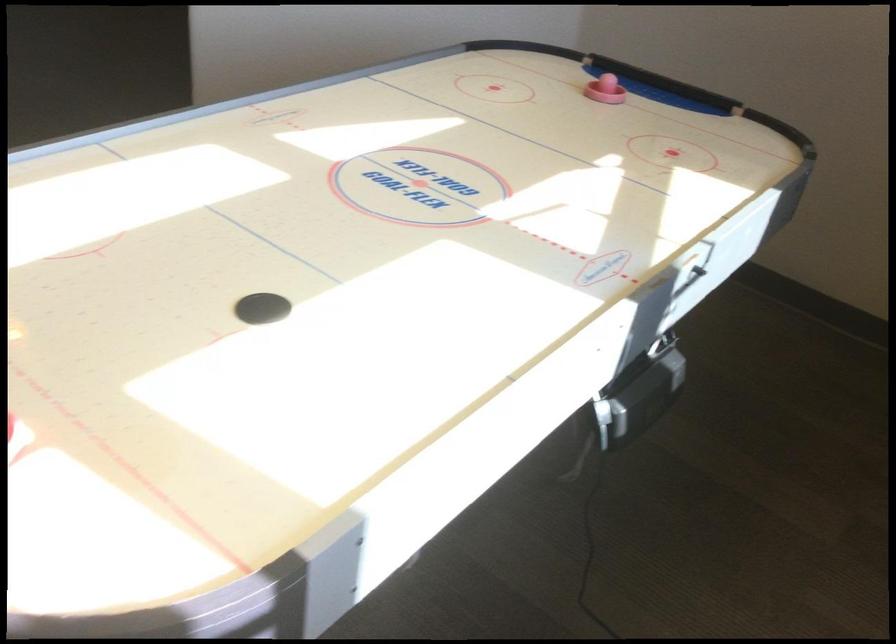
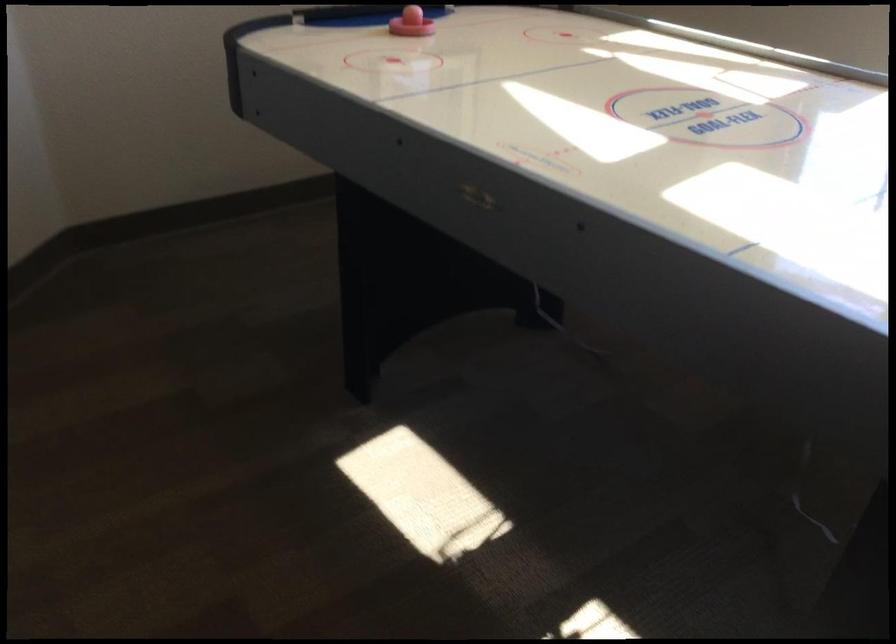
Find the pixel in the second image that matches [579,93] in the first image.

(410, 23)